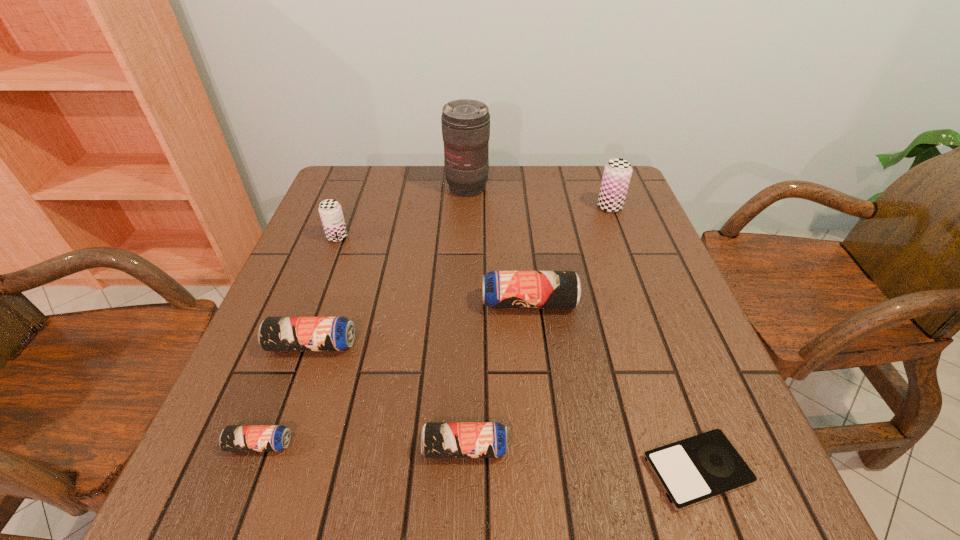
Find the location of a particular element. vacant space located 0.350m on the right of the second smallest blue beer can is located at coordinates (724, 448).

The width and height of the screenshot is (960, 540). Identify the location of vacant space located 0.340m on the back of the smallest blue beer can. (319, 288).

Locate an element on the screen. Image resolution: width=960 pixels, height=540 pixels. free space located on the back of the gray iPod is located at coordinates (651, 342).

The image size is (960, 540). In order to click on telephoto lens positioned at the far edge in this screenshot , I will do `click(465, 123)`.

I want to click on beer can that is at the far edge, so click(x=617, y=173).

Locate an element on the screen. This screenshot has height=540, width=960. beer can that is positioned at the near edge is located at coordinates (438, 439).

You are a GUI agent. You are given a task and a screenshot of the screen. Output one action in this format:
    pyautogui.click(x=<x>, y=<y>)
    Task: Click on the iPod located in the near edge section of the desktop
    
    Given the screenshot: What is the action you would take?
    pyautogui.click(x=699, y=468)

Locate an element on the screen. This screenshot has width=960, height=540. beer can at the right edge is located at coordinates (617, 173).

This screenshot has width=960, height=540. Find the location of `iPod that is at the right edge`. iPod that is at the right edge is located at coordinates (699, 468).

Identify the location of object at the far right corner. The width and height of the screenshot is (960, 540). click(617, 173).